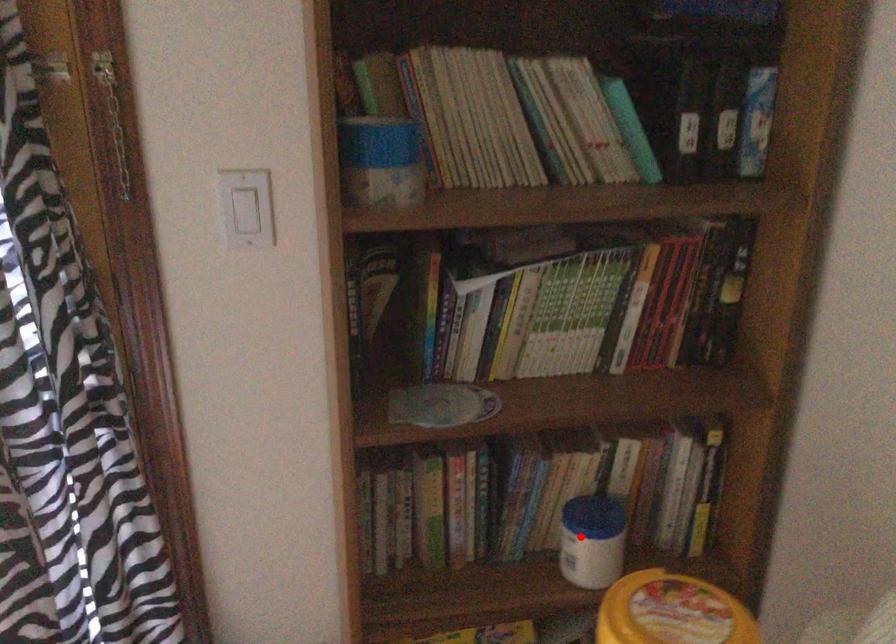
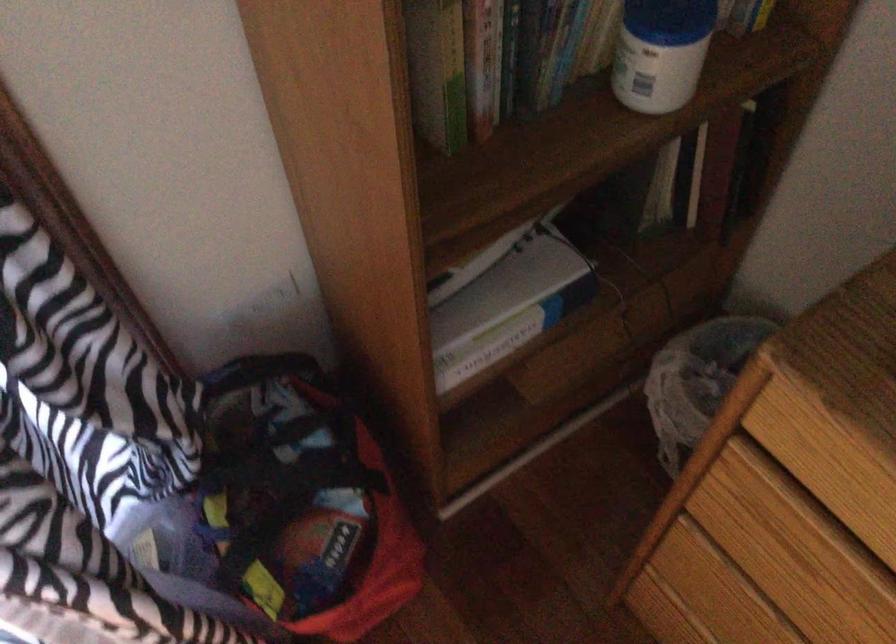
Question: I am providing you with two images of the same scene from different viewpoints. A red point is shown in image1. For the corresponding object point in image2, is it positioned nearer or farther from the camera?

Choices:
 (A) Nearer
 (B) Farther

Answer: (A)